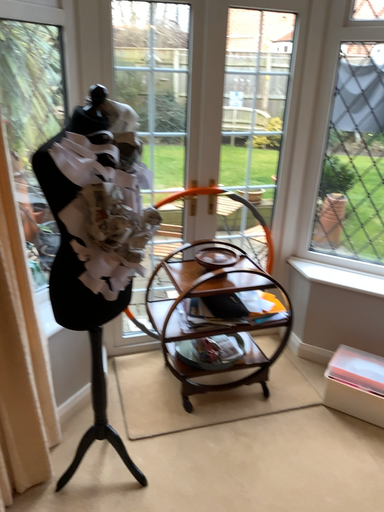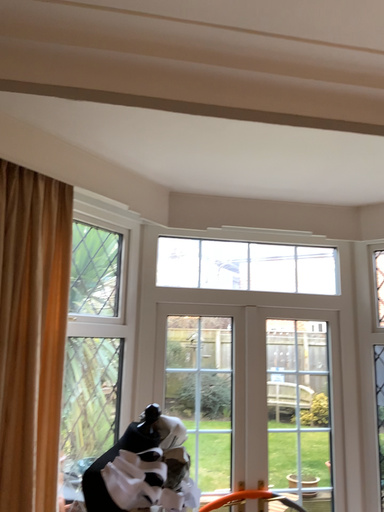
Question: How did the camera likely rotate when shooting the video?

Choices:
 (A) rotated upward
 (B) rotated downward

Answer: (A)